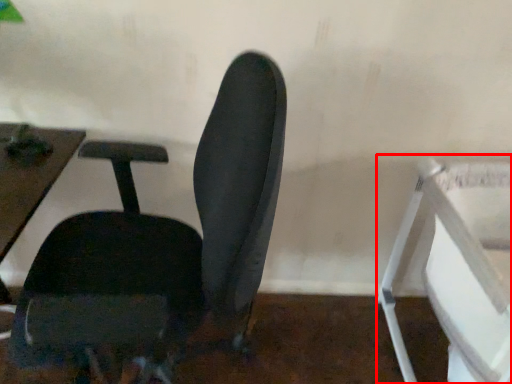
Question: From the image's perspective, where is feeding chair (annotated by the red box) located in relation to chair in the image?

Choices:
 (A) below
 (B) above

Answer: (A)